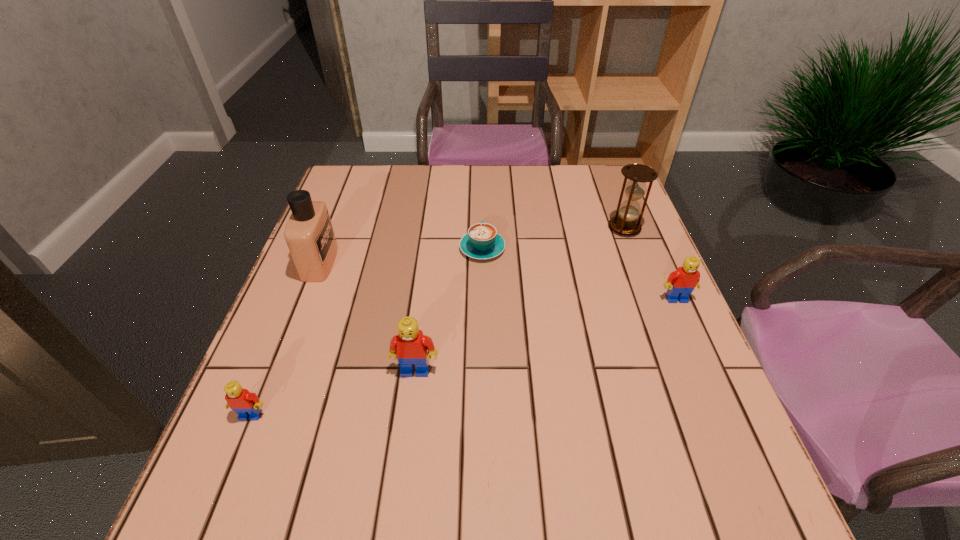
Locate an element on the screen. vacant space that satisfies the following two spatial constraints: 1. with the handle on the right side of the hourglass; 2. on the left side of the cappuccino is located at coordinates (482, 228).

This screenshot has width=960, height=540. Identify the location of vacant region that satisfies the following two spatial constraints: 1. with the handle on the right side of the hourglass; 2. on the left side of the shortest object. pos(482,228).